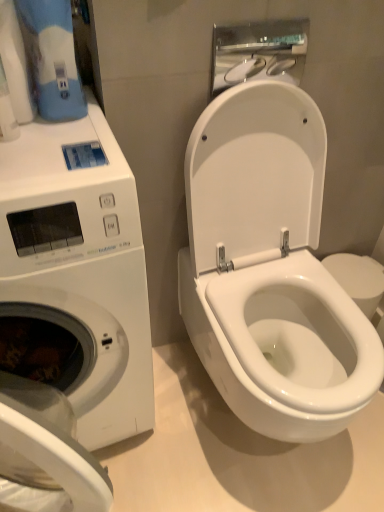
Describe the element at coordinates (81, 266) in the screenshot. I see `white glossy washing machine at left` at that location.

This screenshot has width=384, height=512. I want to click on white glossy toilet at center, so click(x=270, y=269).

From the picture: Measure the distance between point (10,98) and camera.

A distance of 29.09 inches exists between point (10,98) and camera.

In the scene shown: Measure the distance between white glossy toilet paper at upper left and camera.

They are 27.56 inches apart.

Locate an element on the screen. The image size is (384, 512). white glossy washing machine at left is located at coordinates (81, 266).

Considering the relative sizes of white glossy toilet paper at upper left and white glossy hand dryer at upper center in the image provided, is white glossy toilet paper at upper left thinner than white glossy hand dryer at upper center?

Incorrect, the width of white glossy toilet paper at upper left is not less than that of white glossy hand dryer at upper center.

This screenshot has height=512, width=384. In order to click on toilet paper that appears below the white glossy hand dryer at upper center (from the image's perspective) in this screenshot , I will do `click(15, 64)`.

From the image's perspective, which is above, white glossy toilet paper at upper left or white glossy hand dryer at upper center?

From the image's view, white glossy hand dryer at upper center is above.

From a real-world perspective, is white glossy toilet paper at upper left positioned under white glossy hand dryer at upper center based on gravity?

No, from a real-world perspective, white glossy toilet paper at upper left is not beneath white glossy hand dryer at upper center.

Could you tell me if white glossy toilet paper at upper left is facing white glossy washing machine at left?

No, white glossy toilet paper at upper left is not oriented towards white glossy washing machine at left.

This screenshot has width=384, height=512. What are the coordinates of `washing machine on the right of white glossy toilet paper at upper left` in the screenshot? It's located at (81, 266).

Does white glossy toilet paper at upper left appear on the left side of white glossy washing machine at left?

Yes, white glossy toilet paper at upper left is to the left of white glossy washing machine at left.

Who is smaller, white glossy washing machine at left or white glossy toilet at center?

With smaller size is white glossy toilet at center.

Does white glossy washing machine at left have a greater width compared to white glossy toilet at center?

Correct, the width of white glossy washing machine at left exceeds that of white glossy toilet at center.

From a real-world perspective, is white glossy washing machine at left over white glossy toilet at center?

No, from a real-world perspective, white glossy washing machine at left is not over white glossy toilet at center

What's the angular difference between white glossy washing machine at left and white glossy toilet at center's facing directions?

white glossy washing machine at left and white glossy toilet at center are facing 0.000155 degrees away from each other.

Considering their positions, is white glossy toilet at center located in front of or behind white glossy washing machine at left?

white glossy toilet at center is positioned farther from the viewer than white glossy washing machine at left.

Looking at this image, is white glossy toilet at center situated inside white glossy washing machine at left or outside?

white glossy toilet at center is located beyond the bounds of white glossy washing machine at left.

Would you consider white glossy toilet at center to be distant from white glossy washing machine at left?

white glossy toilet at center is actually quite close to white glossy washing machine at left.

Measure the distance from white glossy toilet at center to white glossy washing machine at left.

white glossy toilet at center and white glossy washing machine at left are 33.61 centimeters apart from each other.

Is point (218, 39) positioned behind point (14, 152)?

Yes, point (218, 39) is behind point (14, 152).

Is white glossy hand dryer at upper center positioned with its back to white glossy washing machine at left?

white glossy hand dryer at upper center is not turned away from white glossy washing machine at left.

From the picture: Is white glossy hand dryer at upper center thinner than white glossy washing machine at left?

Correct, the width of white glossy hand dryer at upper center is less than that of white glossy washing machine at left.

Is white glossy hand dryer at upper center smaller than white glossy washing machine at left?

Yes, white glossy hand dryer at upper center is smaller than white glossy washing machine at left.

Is white glossy toilet paper at upper left shorter than white glossy toilet at center?

Indeed, white glossy toilet paper at upper left has a lesser height compared to white glossy toilet at center.

Between white glossy toilet paper at upper left and white glossy toilet at center, which one is positioned in front?

white glossy toilet at center is more forward.

Does white glossy toilet paper at upper left turn towards white glossy toilet at center?

No, white glossy toilet paper at upper left is not oriented towards white glossy toilet at center.

Does white glossy toilet paper at upper left contain white glossy toilet at center?

That's incorrect, white glossy toilet at center is not inside white glossy toilet paper at upper left.

Which is behind, point (320, 172) or point (5, 42)?

The point (320, 172) is more distant.

Is white glossy toilet at center inside the boundaries of white glossy toilet paper at upper left, or outside?

white glossy toilet at center is located beyond the bounds of white glossy toilet paper at upper left.

Can you tell me how much white glossy toilet at center and white glossy toilet paper at upper left differ in facing direction?

0.00028 degrees.

Which of these two, white glossy toilet at center or white glossy toilet paper at upper left, is thinner?

white glossy toilet paper at upper left is thinner.

This screenshot has width=384, height=512. Find the location of `toilet paper lying in front of the white glossy hand dryer at upper center`. toilet paper lying in front of the white glossy hand dryer at upper center is located at coordinates (15, 64).

Identify the location of toilet paper located on the left of white glossy washing machine at left. (15, 64).

Looking at this image, which object lies nearer to the anchor point white glossy hand dryer at upper center, white glossy toilet at center or white glossy toilet paper at upper left?

white glossy toilet at center is positioned closer to the anchor white glossy hand dryer at upper center.

Considering their positions, is white glossy hand dryer at upper center positioned closer to white glossy washing machine at left than white glossy toilet at center?

Based on the image, white glossy toilet at center appears to be nearer to white glossy washing machine at left.

Which object lies nearer to the anchor point white glossy toilet at center, white glossy hand dryer at upper center or white glossy washing machine at left?

Based on the image, white glossy washing machine at left appears to be nearer to white glossy toilet at center.

Which object lies further to the anchor point white glossy toilet at center, white glossy hand dryer at upper center or white glossy toilet paper at upper left?

white glossy toilet paper at upper left lies further to white glossy toilet at center than the other object.

Looking at this image, based on their spatial positions, is white glossy toilet at center or white glossy washing machine at left closer to white glossy hand dryer at upper center?

white glossy toilet at center is positioned closer to the anchor white glossy hand dryer at upper center.

Estimate the real-world distances between objects in this image. Which object is further from white glossy washing machine at left, white glossy toilet at center or white glossy toilet paper at upper left?

white glossy toilet paper at upper left is further to white glossy washing machine at left.

Based on their spatial positions, is white glossy toilet at center or white glossy hand dryer at upper center closer to white glossy washing machine at left?

white glossy toilet at center.

From the image, which object appears to be farther from white glossy toilet paper at upper left, white glossy toilet at center or white glossy hand dryer at upper center?

The object further to white glossy toilet paper at upper left is white glossy toilet at center.

Where is `toilet paper between white glossy hand dryer at upper center and white glossy washing machine at left vertically`? The height and width of the screenshot is (512, 384). toilet paper between white glossy hand dryer at upper center and white glossy washing machine at left vertically is located at coordinates (15, 64).

You are a GUI agent. You are given a task and a screenshot of the screen. Output one action in this format:
    pyautogui.click(x=<x>, y=<y>)
    Task: Click on the toilet that lies between white glossy hand dryer at upper center and white glossy washing machine at left from top to bottom
    The image size is (384, 512).
    Given the screenshot: What is the action you would take?
    pyautogui.click(x=270, y=269)

This screenshot has width=384, height=512. What are the coordinates of `washing machine between white glossy toilet paper at upper left and white glossy toilet at center from left to right` in the screenshot? It's located at (81, 266).

Where is `hand dryer between white glossy toilet paper at upper left and white glossy toilet at center`? Image resolution: width=384 pixels, height=512 pixels. hand dryer between white glossy toilet paper at upper left and white glossy toilet at center is located at coordinates (258, 52).